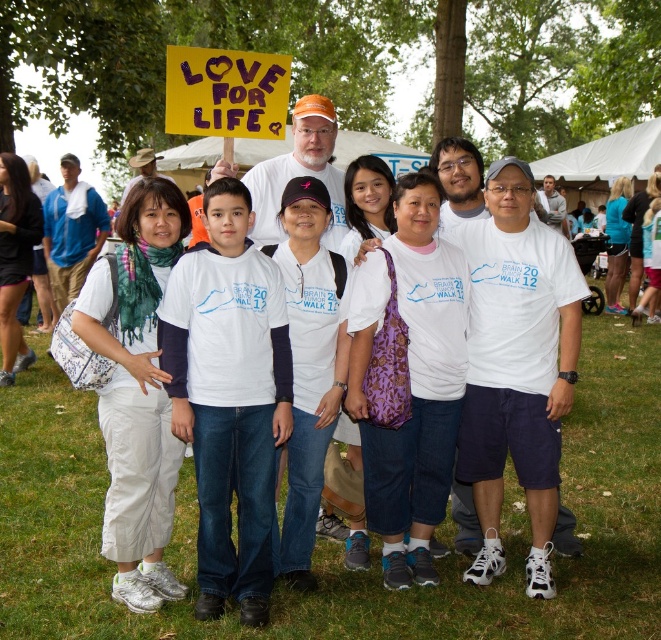
You are taking a photo of the group and notice two points marked in the image. Which point is closer to you, point (196,294) or point (200,54)?

Point (196,294) is closer to you than point (200,54).